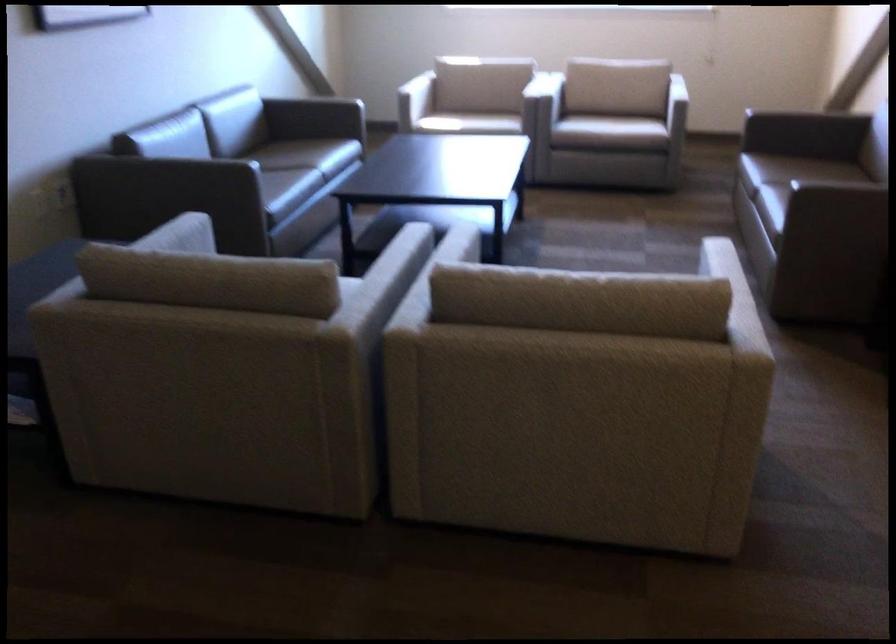
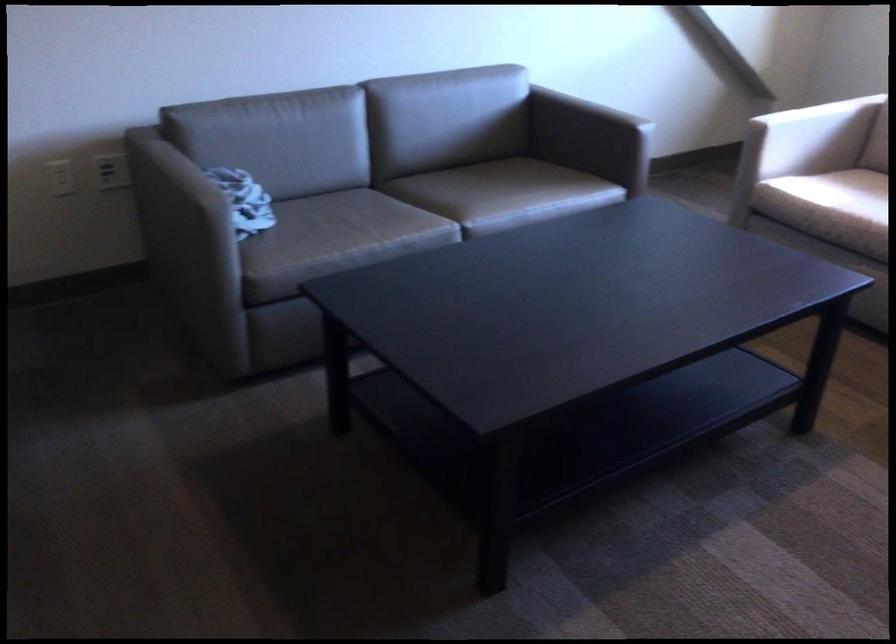
Where in the second image is the point corresponding to (x=257, y=93) from the first image?

(605, 93)